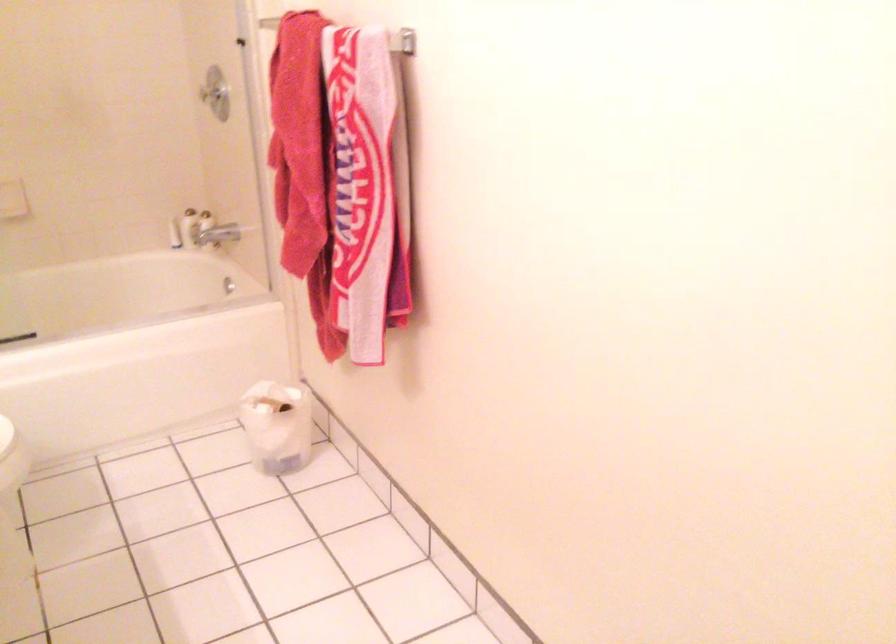
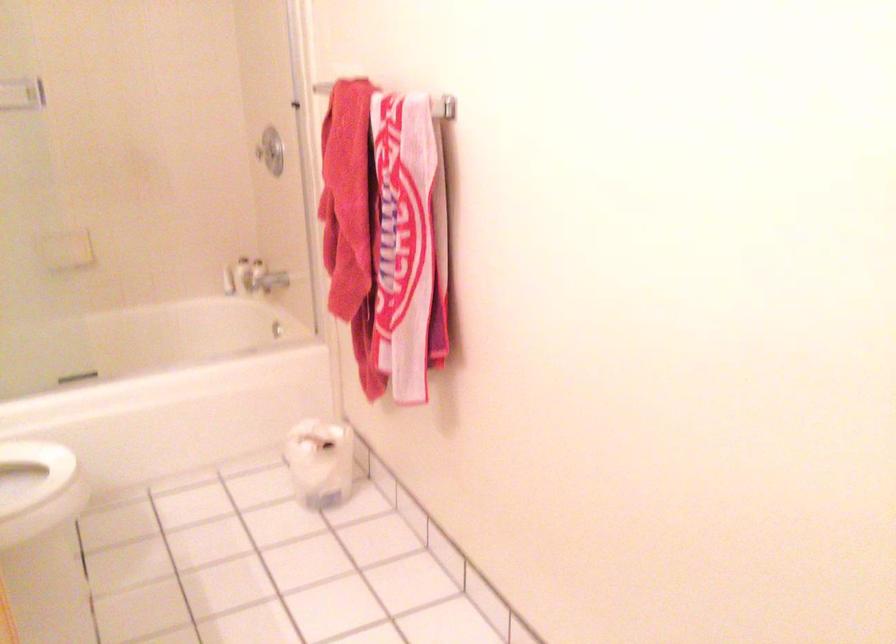
Question: Based on the continuous images, in which direction is the camera rotating? Reply with the corresponding letter.

Choices:
 (A) Left
 (B) Right
 (C) Up
 (D) Down

Answer: (C)